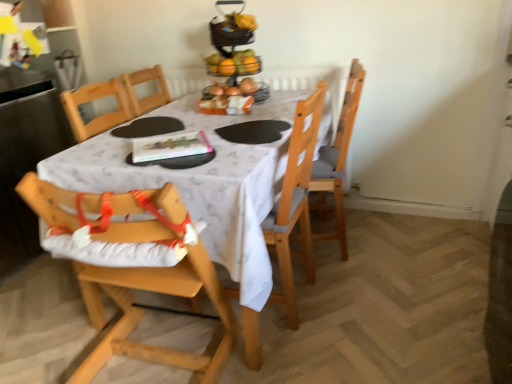
Question: Which direction should I rotate to look at shiny metallic fruit basket at upper center?

Choices:
 (A) right
 (B) left

Answer: (B)

Question: Can you confirm if wooden chair at center, acting as the 2th chair starting from the left, is taller than wooden highchair at lower left, positioned as the 1th chair in left-to-right order?

Choices:
 (A) no
 (B) yes

Answer: (B)

Question: Does wooden chair at center, acting as the second chair starting from the right, come in front of wooden highchair at lower left, positioned as the 1th chair in left-to-right order?

Choices:
 (A) yes
 (B) no

Answer: (B)

Question: Is wooden chair at center, acting as the second chair starting from the right, aimed at wooden highchair at lower left, the third chair when ordered from right to left?

Choices:
 (A) yes
 (B) no

Answer: (B)

Question: From a real-world perspective, is wooden chair at center, acting as the second chair starting from the right, located beneath wooden highchair at lower left, the third chair when ordered from right to left?

Choices:
 (A) yes
 (B) no

Answer: (B)

Question: Are wooden chair at center, acting as the second chair starting from the right, and wooden highchair at lower left, the third chair when ordered from right to left, making contact?

Choices:
 (A) no
 (B) yes

Answer: (A)

Question: Is white fabric table at center smaller than wooden highchair at lower left, the third chair when ordered from right to left?

Choices:
 (A) no
 (B) yes

Answer: (A)

Question: Is white fabric table at center facing towards wooden highchair at lower left, positioned as the 1th chair in left-to-right order?

Choices:
 (A) yes
 (B) no

Answer: (A)

Question: Can you confirm if white fabric table at center is thinner than wooden highchair at lower left, the third chair when ordered from right to left?

Choices:
 (A) yes
 (B) no

Answer: (B)

Question: Is white fabric table at center turned away from wooden highchair at lower left, the third chair when ordered from right to left?

Choices:
 (A) no
 (B) yes

Answer: (A)

Question: Is white fabric table at center further to camera compared to wooden highchair at lower left, positioned as the 1th chair in left-to-right order?

Choices:
 (A) yes
 (B) no

Answer: (A)

Question: From a real-world perspective, is white fabric table at center beneath wooden highchair at lower left, the third chair when ordered from right to left?

Choices:
 (A) no
 (B) yes

Answer: (B)

Question: Is orange plastic basket at center touching wooden chair at right, which appears as the 1th chair when viewed from the right?

Choices:
 (A) no
 (B) yes

Answer: (A)